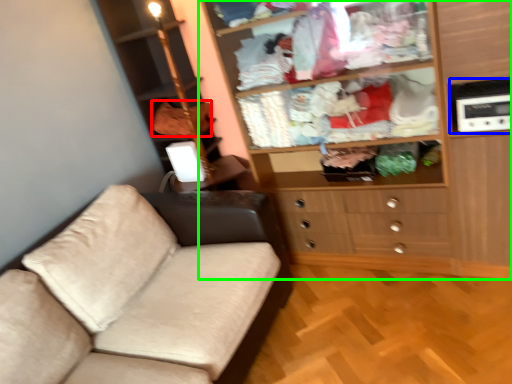
Question: Estimate the real-world distances between objects in this image. Which object is farther from clothing (highlighted by a red box), appliance (highlighted by a blue box) or cupboard (highlighted by a green box)?

Choices:
 (A) appliance
 (B) cupboard

Answer: (A)